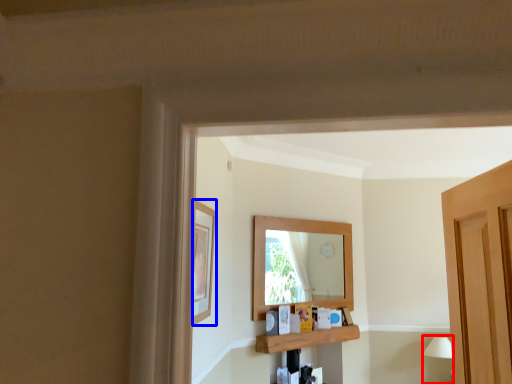
Question: Which object appears closest to the camera in this image, lamp (highlighted by a red box) or picture frame (highlighted by a blue box)?

Choices:
 (A) lamp
 (B) picture frame

Answer: (B)